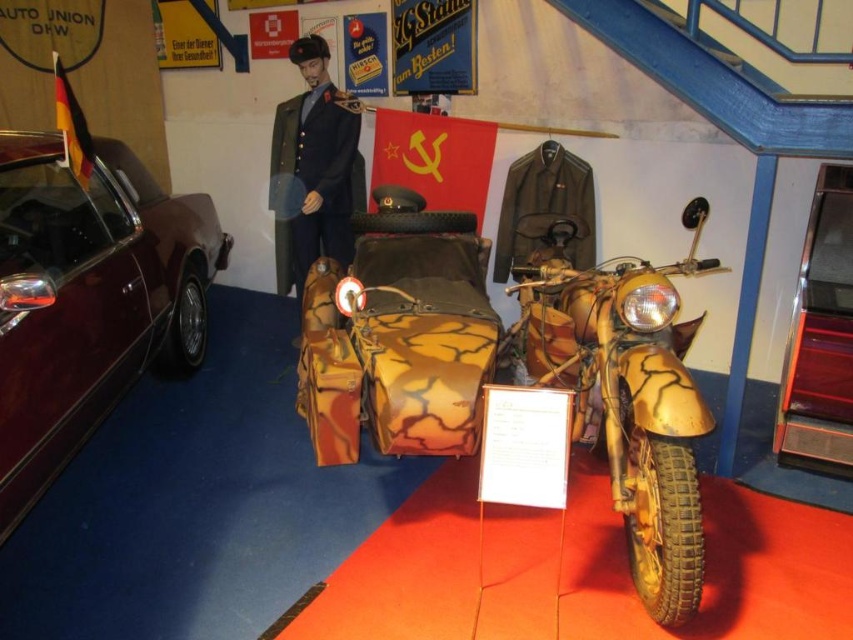
You are a tour guide at the museum and want to mention the relative sizes of the glossy maroon car at left and the matte black jacket at upper center to your visitors. Which object is wider?

The glossy maroon car at left is wider than the matte black jacket at upper center.

You are a tour guide explaining the exhibit layout to a visitor. Pointing to the glossy maroon car at left and the camouflage fabric sidecar at center, you need to describe their relative positions. Which object is positioned to the left of the other?

The glossy maroon car at left is to the left of the camouflage fabric sidecar at center.